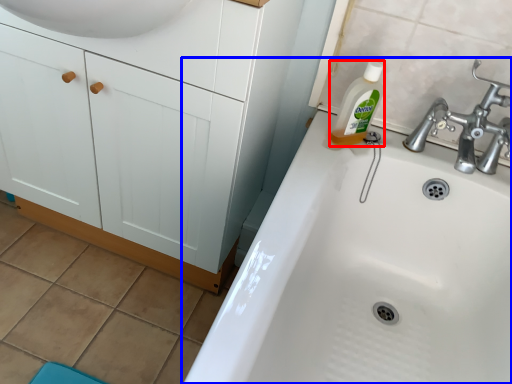
Question: Which object appears farthest to the camera in this image, cleaning product (highlighted by a red box) or sink (highlighted by a blue box)?

Choices:
 (A) cleaning product
 (B) sink

Answer: (A)